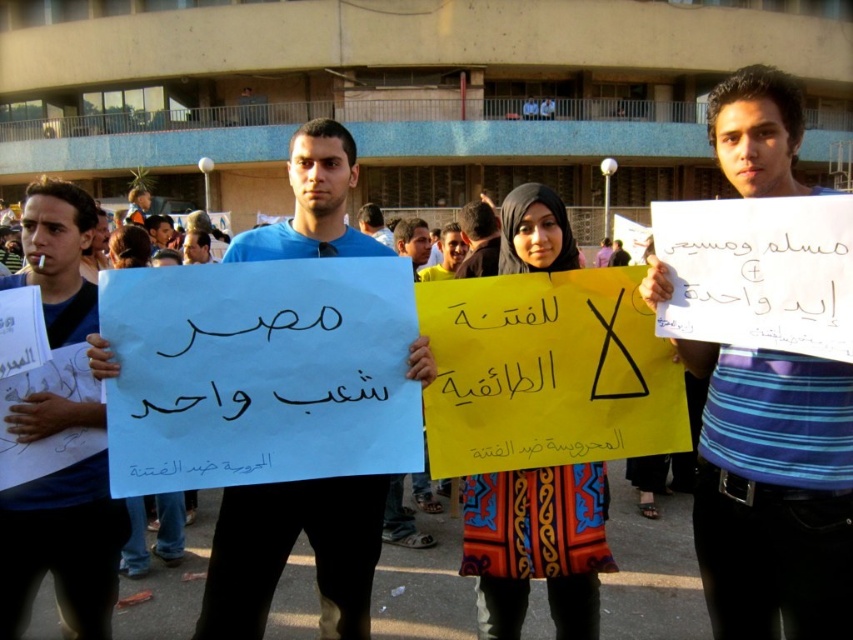
Who is higher up, blue striped shirt at center or blue paper at left?

Positioned higher is blue striped shirt at center.

Between point (738, 148) and point (84, 588), which one is positioned in front?

Point (738, 148) is more forward.

This screenshot has height=640, width=853. Find the location of `blue striped shirt at center`. blue striped shirt at center is located at coordinates (773, 492).

This screenshot has width=853, height=640. Find the location of `blue striped shirt at center`. blue striped shirt at center is located at coordinates (773, 492).

Can you confirm if blue paper sign at center is positioned below matte blue shirt at center?

Correct, blue paper sign at center is located below matte blue shirt at center.

Which is more to the right, blue paper sign at center or matte blue shirt at center?

From the viewer's perspective, blue paper sign at center appears more on the right side.

This screenshot has width=853, height=640. What do you see at coordinates (289, 552) in the screenshot?
I see `blue paper sign at center` at bounding box center [289, 552].

This screenshot has height=640, width=853. I want to click on blue paper sign at center, so click(x=289, y=552).

Who is lower down, blue paper at left or matte blue shirt at center?

blue paper at left is below.

Is point (91, 497) in front of point (375, 228)?

Yes.

This screenshot has width=853, height=640. I want to click on blue paper at left, so (x=62, y=548).